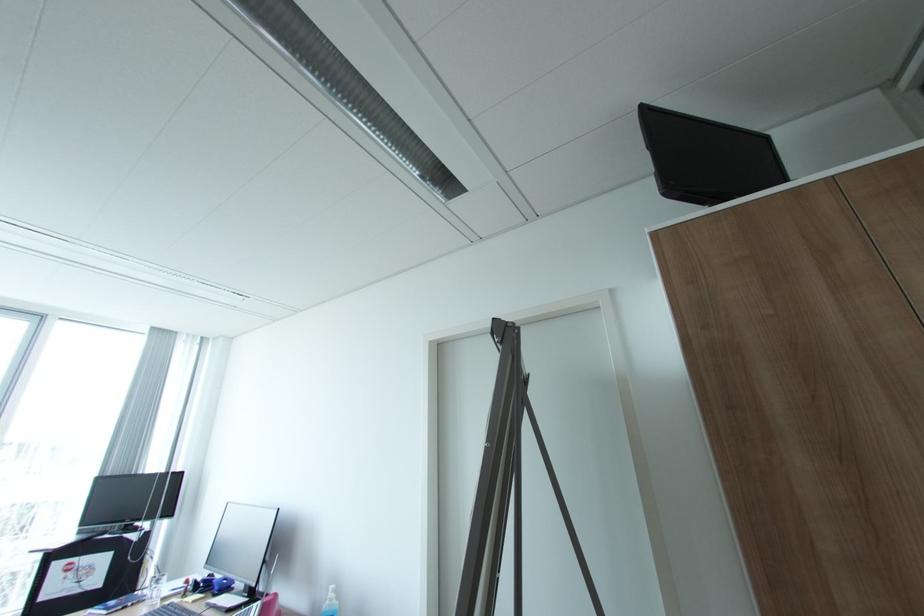
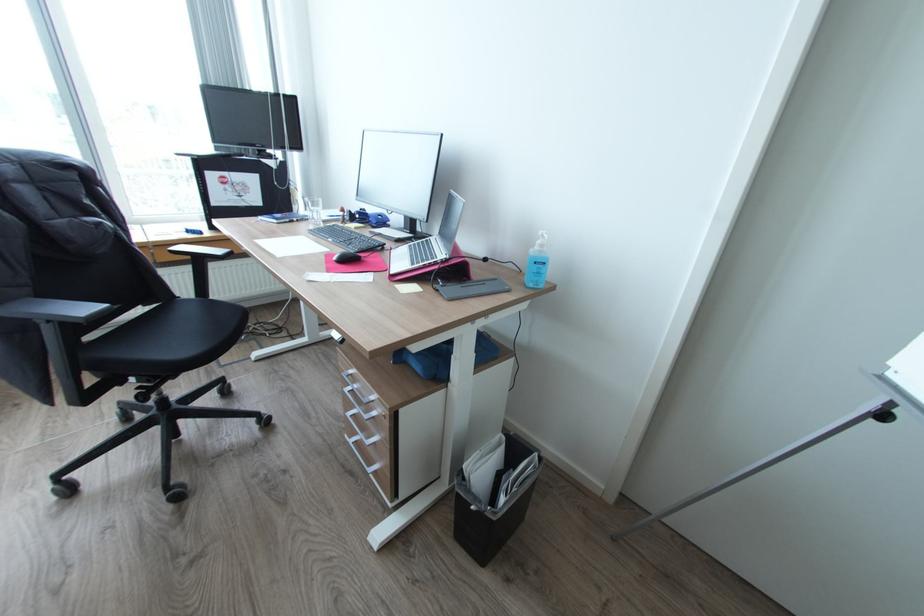
Find the pixel in the second image that matches (207,584) in the first image.

(362, 216)